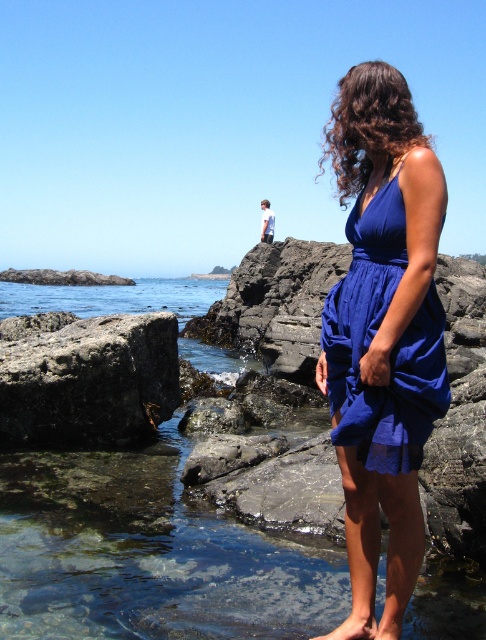
Who is positioned more to the right, blue silk dress at center or clear water at lower left?

blue silk dress at center

Between point (375, 227) and point (2, 314), which one is positioned in front?

Point (375, 227) is more forward.

You are a GUI agent. You are given a task and a screenshot of the screen. Output one action in this format:
    pyautogui.click(x=<x>, y=<y>)
    Task: Click on the blue silk dress at center
    The image size is (486, 640).
    Given the screenshot: What is the action you would take?
    pyautogui.click(x=388, y=324)

Can you confirm if blue fabric dress at center is bigger than rusty metal rock at lower left?

Indeed, blue fabric dress at center has a larger size compared to rusty metal rock at lower left.

Looking at this image, can you confirm if blue fabric dress at center is smaller than rusty metal rock at lower left?

Actually, blue fabric dress at center might be larger than rusty metal rock at lower left.

The image size is (486, 640). Describe the element at coordinates (382, 333) in the screenshot. I see `blue fabric dress at center` at that location.

The height and width of the screenshot is (640, 486). In order to click on blue fabric dress at center in this screenshot , I will do `click(382, 333)`.

Is rusty metal rock at lower left wider than clear water at lower left?

In fact, rusty metal rock at lower left might be narrower than clear water at lower left.

Measure the distance between point (161, 396) and camera.

The distance of point (161, 396) from camera is 11.24 meters.

This screenshot has height=640, width=486. What are the coordinates of `rusty metal rock at lower left` in the screenshot? It's located at (86, 376).